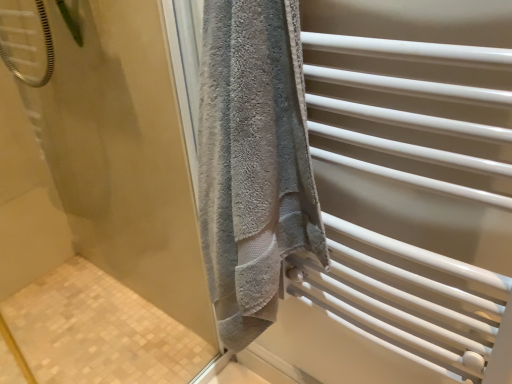
You are a GUI agent. You are given a task and a screenshot of the screen. Output one action in this format:
    pyautogui.click(x=<x>, y=<y>)
    Task: Click on the gray towel at right, which is the 2th screen door in left-to-right order
    This screenshot has height=384, width=512.
    Given the screenshot: What is the action you would take?
    pyautogui.click(x=406, y=194)

Describe the element at coordinates (406, 194) in the screenshot. I see `gray towel at right, which is the 2th screen door in left-to-right order` at that location.

You are a GUI agent. You are given a task and a screenshot of the screen. Output one action in this format:
    pyautogui.click(x=<x>, y=<y>)
    Task: Click on the gray towel at upper right, the 1th screen door in the left-to-right sequence
    The width and height of the screenshot is (512, 384).
    Given the screenshot: What is the action you would take?
    pyautogui.click(x=123, y=155)

The height and width of the screenshot is (384, 512). Describe the element at coordinates (123, 155) in the screenshot. I see `gray towel at upper right, the 1th screen door in the left-to-right sequence` at that location.

Where is `gray towel at right, which is the 2th screen door in left-to-right order`? The width and height of the screenshot is (512, 384). gray towel at right, which is the 2th screen door in left-to-right order is located at coordinates (406, 194).

Considering the relative positions of gray towel at right, which is the 2th screen door in left-to-right order, and gray towel at upper right, placed as the second screen door when sorted from right to left, in the image provided, is gray towel at right, which is the 2th screen door in left-to-right order, to the left or to the right of gray towel at upper right, placed as the second screen door when sorted from right to left,?

In the image, gray towel at right, which is the 2th screen door in left-to-right order, appears on the right side of gray towel at upper right, placed as the second screen door when sorted from right to left.

Which object is closer to the camera, gray towel at right, the 1th screen door from the right, or gray towel at upper right, the 1th screen door in the left-to-right sequence?

gray towel at upper right, the 1th screen door in the left-to-right sequence.

Is point (337, 58) positioned behind point (92, 154)?

No, (337, 58) is closer to viewer.

From the image's perspective, is gray towel at right, the 1th screen door from the right, above or below gray towel at upper right, placed as the second screen door when sorted from right to left?

Based on their image positions, gray towel at right, the 1th screen door from the right, is located above gray towel at upper right, placed as the second screen door when sorted from right to left.

From a real-world perspective, is gray towel at right, the 1th screen door from the right, above or below gray towel at upper right, the 1th screen door in the left-to-right sequence?

gray towel at right, the 1th screen door from the right, is above gray towel at upper right, the 1th screen door in the left-to-right sequence.

Does gray towel at right, the 1th screen door from the right, have a greater width compared to gray towel at upper right, placed as the second screen door when sorted from right to left?

Indeed, gray towel at right, the 1th screen door from the right, has a greater width compared to gray towel at upper right, placed as the second screen door when sorted from right to left.

Considering the relative sizes of gray towel at right, which is the 2th screen door in left-to-right order, and gray towel at upper right, the 1th screen door in the left-to-right sequence, in the image provided, is gray towel at right, which is the 2th screen door in left-to-right order, shorter than gray towel at upper right, the 1th screen door in the left-to-right sequence,?

Yes.

Does gray towel at right, which is the 2th screen door in left-to-right order, have a larger size compared to gray towel at upper right, the 1th screen door in the left-to-right sequence?

No, gray towel at right, which is the 2th screen door in left-to-right order, is not bigger than gray towel at upper right, the 1th screen door in the left-to-right sequence.

Is gray towel at right, which is the 2th screen door in left-to-right order, inside the boundaries of gray towel at upper right, the 1th screen door in the left-to-right sequence, or outside?

gray towel at right, which is the 2th screen door in left-to-right order, is not enclosed by gray towel at upper right, the 1th screen door in the left-to-right sequence.

Is gray towel at right, which is the 2th screen door in left-to-right order, positioned far away from gray towel at upper right, the 1th screen door in the left-to-right sequence?

That's not correct — gray towel at right, which is the 2th screen door in left-to-right order, is a little close to gray towel at upper right, the 1th screen door in the left-to-right sequence.

Is gray towel at right, the 1th screen door from the right, oriented towards gray towel at upper right, the 1th screen door in the left-to-right sequence?

No.

How distant is gray towel at right, which is the 2th screen door in left-to-right order, from gray towel at upper right, the 1th screen door in the left-to-right sequence?

They are 54.82 centimeters apart.

The width and height of the screenshot is (512, 384). What are the coordinates of `screen door that is under the gray towel at right, which is the 2th screen door in left-to-right order (from a real-world perspective)` in the screenshot? It's located at (123, 155).

Which object is positioned more to the left, gray towel at upper right, placed as the second screen door when sorted from right to left, or gray towel at right, which is the 2th screen door in left-to-right order?

From the viewer's perspective, gray towel at upper right, placed as the second screen door when sorted from right to left, appears more on the left side.

Is gray towel at upper right, placed as the second screen door when sorted from right to left, closer to camera compared to gray towel at right, the 1th screen door from the right?

Yes, gray towel at upper right, placed as the second screen door when sorted from right to left, is closer to the viewer.

Is point (36, 119) closer to camera compared to point (466, 112)?

No, it is behind (466, 112).

From the image's perspective, is gray towel at upper right, placed as the second screen door when sorted from right to left, located above or below gray towel at right, the 1th screen door from the right?

gray towel at upper right, placed as the second screen door when sorted from right to left, is below gray towel at right, the 1th screen door from the right.

From a real-world perspective, is gray towel at upper right, placed as the second screen door when sorted from right to left, physically located above or below gray towel at right, which is the 2th screen door in left-to-right order?

gray towel at upper right, placed as the second screen door when sorted from right to left, is situated lower than gray towel at right, which is the 2th screen door in left-to-right order, in the real world.

Considering the relative sizes of gray towel at upper right, placed as the second screen door when sorted from right to left, and gray towel at right, the 1th screen door from the right, in the image provided, is gray towel at upper right, placed as the second screen door when sorted from right to left, wider than gray towel at right, the 1th screen door from the right,?

In fact, gray towel at upper right, placed as the second screen door when sorted from right to left, might be narrower than gray towel at right, the 1th screen door from the right.

Considering the relative sizes of gray towel at upper right, placed as the second screen door when sorted from right to left, and gray towel at right, the 1th screen door from the right, in the image provided, is gray towel at upper right, placed as the second screen door when sorted from right to left, shorter than gray towel at right, the 1th screen door from the right,?

No, gray towel at upper right, placed as the second screen door when sorted from right to left, is not shorter than gray towel at right, the 1th screen door from the right.

From the picture: Considering the sizes of objects gray towel at upper right, the 1th screen door in the left-to-right sequence, and gray towel at right, which is the 2th screen door in left-to-right order, in the image provided, who is smaller, gray towel at upper right, the 1th screen door in the left-to-right sequence, or gray towel at right, which is the 2th screen door in left-to-right order,?

gray towel at right, which is the 2th screen door in left-to-right order.

Is gray towel at upper right, placed as the second screen door when sorted from right to left, positioned beyond the bounds of gray towel at right, the 1th screen door from the right?

gray towel at upper right, placed as the second screen door when sorted from right to left, is positioned outside gray towel at right, the 1th screen door from the right.

Would you consider gray towel at upper right, the 1th screen door in the left-to-right sequence, to be distant from gray towel at right, the 1th screen door from the right?

No, gray towel at upper right, the 1th screen door in the left-to-right sequence, is not far away from gray towel at right, the 1th screen door from the right.

Is gray towel at upper right, the 1th screen door in the left-to-right sequence, oriented away from gray towel at right, the 1th screen door from the right?

No.

What's the angular difference between gray towel at upper right, placed as the second screen door when sorted from right to left, and gray towel at right, the 1th screen door from the right,'s facing directions?

89.6 degrees separate the facing orientations of gray towel at upper right, placed as the second screen door when sorted from right to left, and gray towel at right, the 1th screen door from the right.

Identify the location of screen door that is above the gray towel at upper right, the 1th screen door in the left-to-right sequence (from a real-world perspective). (406, 194).

Where is `screen door lying on the left of gray towel at right, which is the 2th screen door in left-to-right order`? screen door lying on the left of gray towel at right, which is the 2th screen door in left-to-right order is located at coordinates (123, 155).

The image size is (512, 384). What are the coordinates of `screen door behind the gray towel at upper right, placed as the second screen door when sorted from right to left` in the screenshot? It's located at (406, 194).